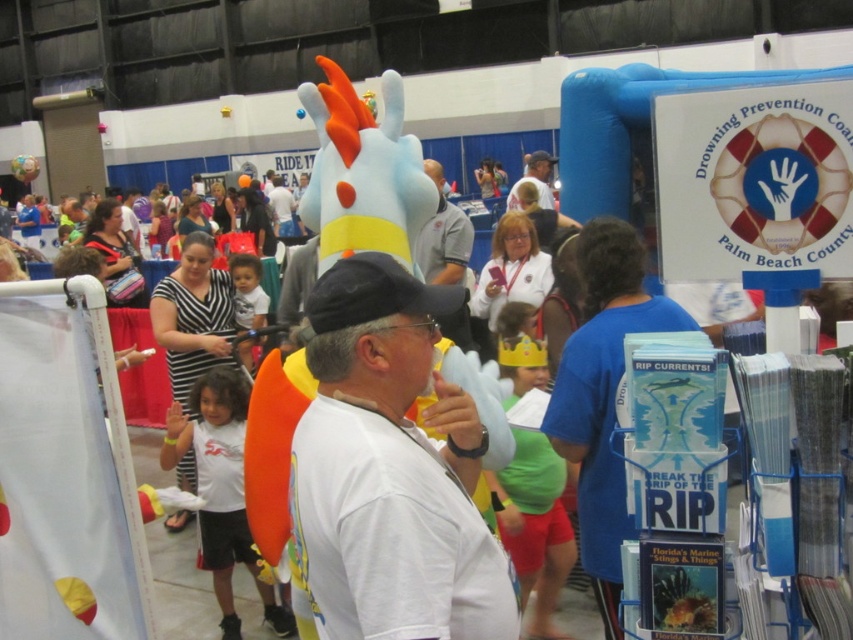
Does point (415, 388) come behind point (427, 275)?

No, (415, 388) is in front of (427, 275).

Does white matte shirt at center appear over gray fabric shirt at center?

Incorrect, white matte shirt at center is not positioned above gray fabric shirt at center.

Does point (398, 413) lie in front of point (463, 248)?

Yes, point (398, 413) is closer to viewer.

Find the location of a particular element. The height and width of the screenshot is (640, 853). white matte shirt at center is located at coordinates (392, 465).